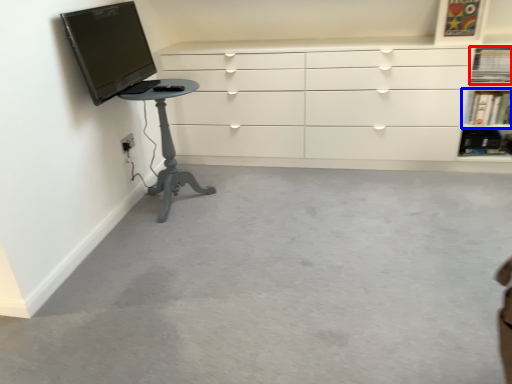
Question: Which of the following is the farthest to the observer, shelf (highlighted by a red box) or shelf (highlighted by a blue box)?

Choices:
 (A) shelf
 (B) shelf

Answer: (B)